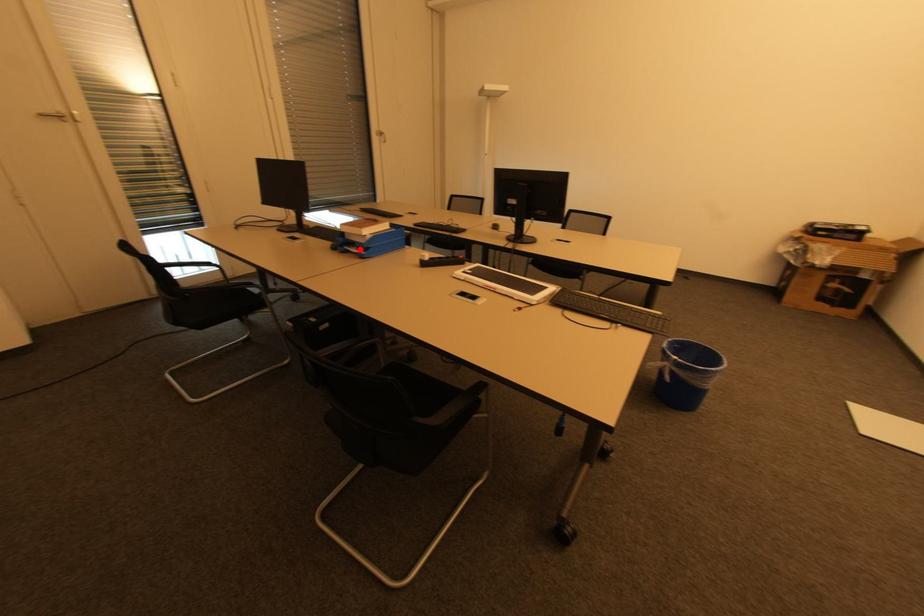
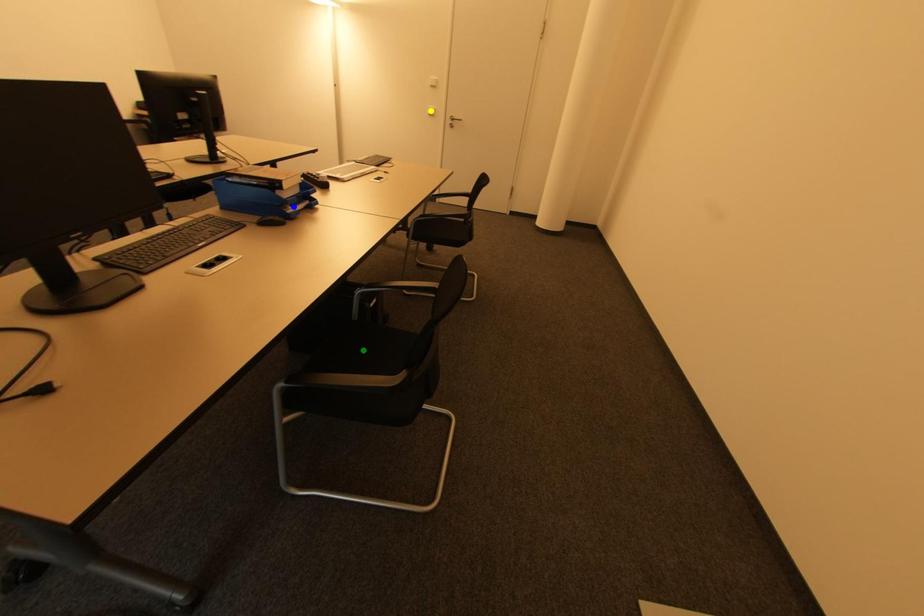
Question: I am providing you with two images of the same scene from different viewpoints. A red point is marked on the first image. You are given multiple points on the second image. Can you choose the point in image 2 that corresponds to the point in image 1?

Choices:
 (A) green point
 (B) yellow point
 (C) blue point

Answer: (C)